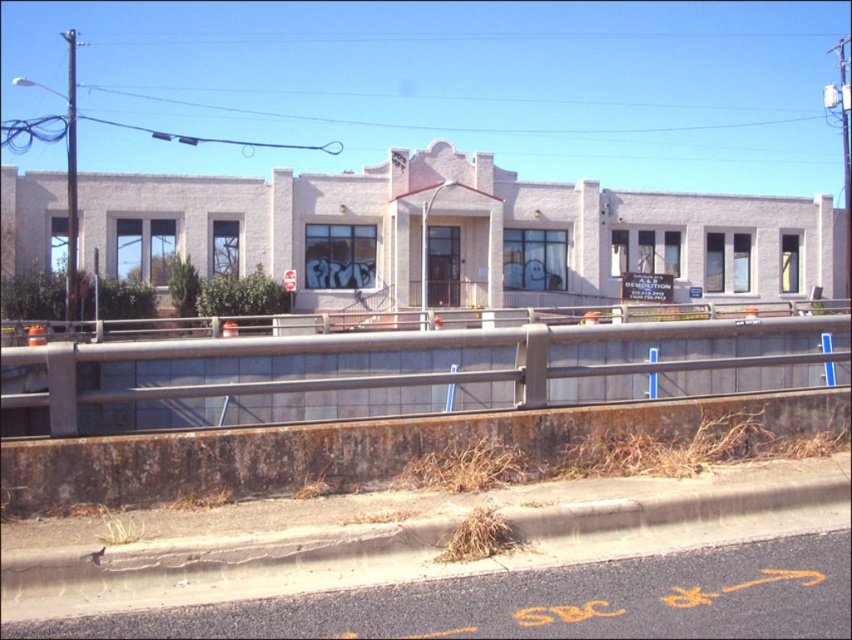
Question: Considering the real-world distances, which object is farthest from the concrete curb at lower center?

Choices:
 (A) brown dry grass at lower center
 (B) rusty concrete curb at lower center

Answer: (B)

Question: Which object is farther from the camera taking this photo?

Choices:
 (A) rusty metal rail at center
 (B) concrete curb at lower center
 (C) brown dry grass at lower center

Answer: (A)

Question: Does rusty concrete curb at lower center appear under brown dry grass at lower center?

Choices:
 (A) no
 (B) yes

Answer: (A)

Question: Among these points, which one is farthest from the camera?

Choices:
 (A) (260, 474)
 (B) (331, 557)
 (C) (338, 339)
 (D) (504, 545)

Answer: (C)

Question: Does rusty concrete curb at lower center appear under brown dry grass at lower center?

Choices:
 (A) no
 (B) yes

Answer: (A)

Question: Can you confirm if rusty metal rail at center is thinner than brown dry grass at lower center?

Choices:
 (A) yes
 (B) no

Answer: (B)